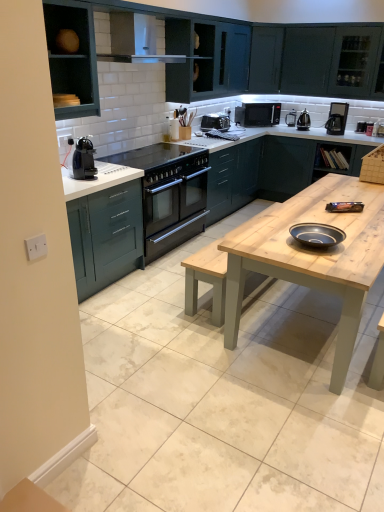
Find the location of `free spot above light wood table at center (from a real-world perspective)`. free spot above light wood table at center (from a real-world perspective) is located at coordinates (342, 220).